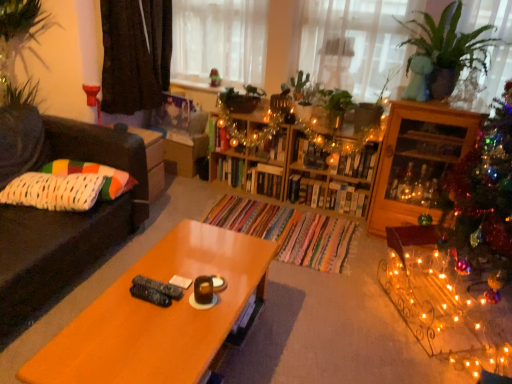
Locate an element on the screen. empty space that is ontop of wooden coffee table at center (from a real-world perspective) is located at coordinates (174, 292).